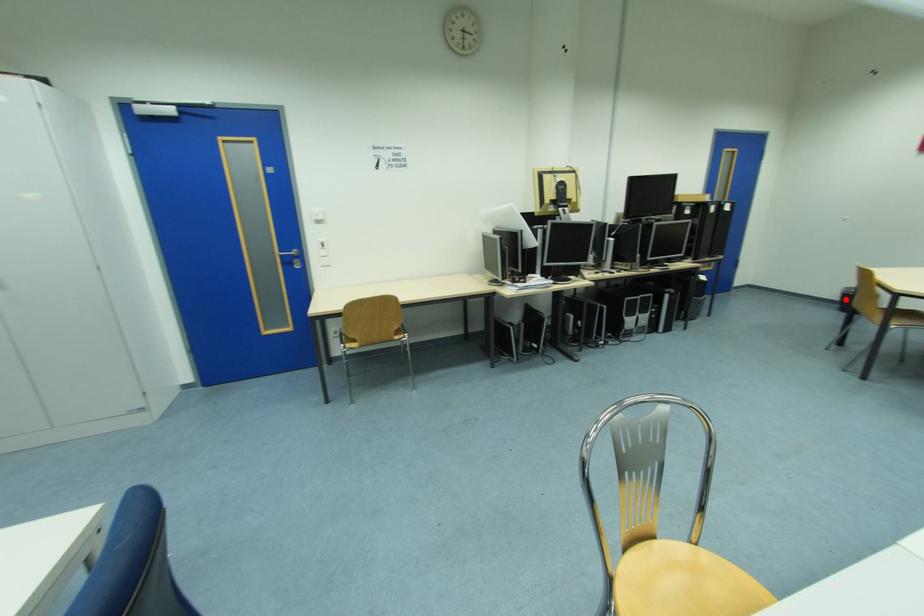
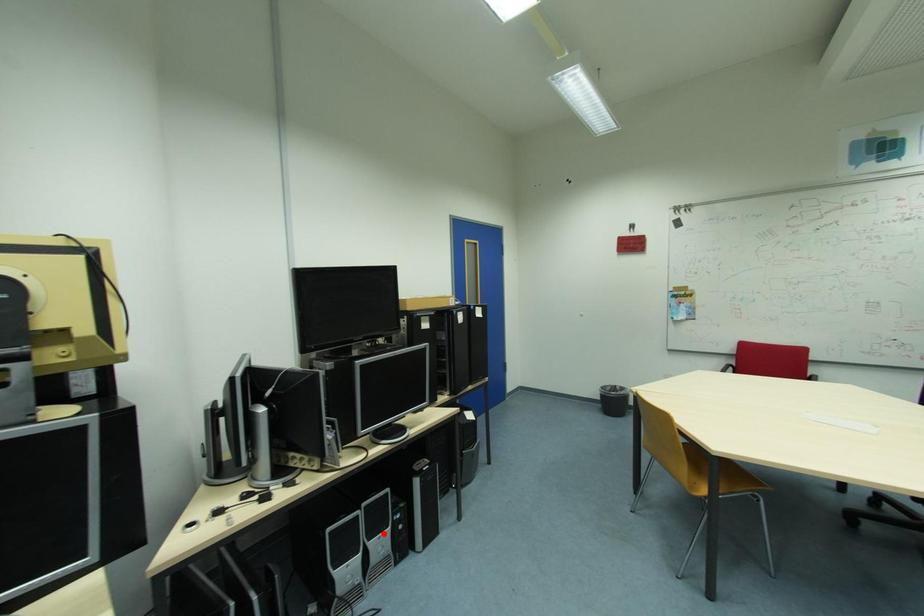
I am providing you with two images of the same scene from different viewpoints. A red point is marked on the first image and another point is marked on the second image. Do the highlighted points in image1 and image2 indicate the same real-world spot?

No